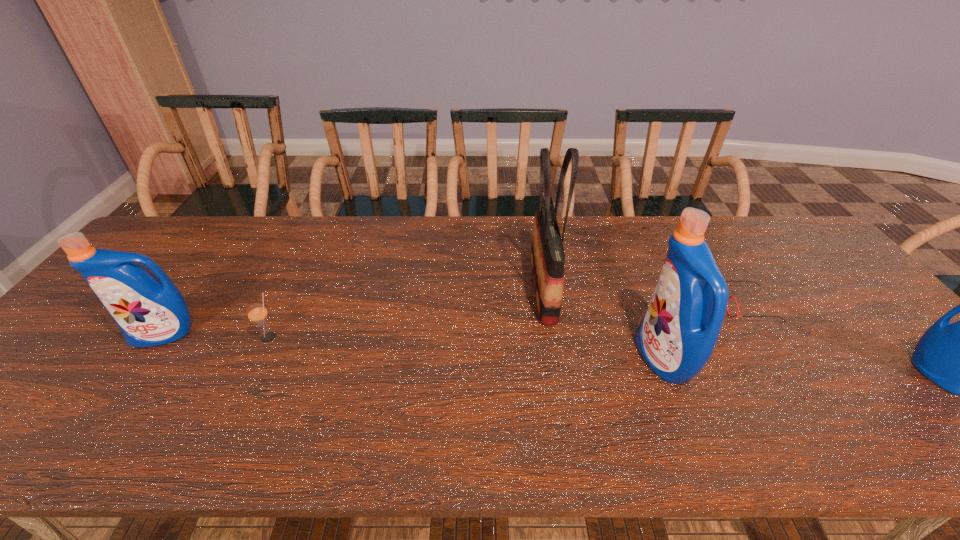
Image resolution: width=960 pixels, height=540 pixels. I want to click on free spot between the third object from right to left and the second shortest object, so click(466, 348).

Where is `free space that is in between the leftmost detergent and the fifth object from left to right`? free space that is in between the leftmost detergent and the fifth object from left to right is located at coordinates (456, 320).

The image size is (960, 540). What are the coordinates of `vacant area between the second shortest object and the fourth object from left to right` in the screenshot? It's located at (466, 348).

Image resolution: width=960 pixels, height=540 pixels. Find the location of `object that stands as the third closest to the rightmost object`. object that stands as the third closest to the rightmost object is located at coordinates (547, 253).

Select which object is the second closest to the fourth object from right to left. Please provide its 2D coordinates. Your answer should be formatted as a tuple, i.e. [(x, y)], where the tuple contains the x and y coordinates of a point satisfying the conditions above.

[(726, 281)]

Locate which detergent ranks second in proximity to the fourth object from right to left. Please provide its 2D coordinates. Your answer should be formatted as a tuple, i.e. [(x, y)], where the tuple contains the x and y coordinates of a point satisfying the conditions above.

[(959, 357)]

The image size is (960, 540). I want to click on detergent that is the closest to the rightmost object, so 678,333.

Locate an element on the screen. vacant space that satisfies the following two spatial constraints: 1. on the front-facing side of the second object from right to left; 2. on the front side of the fifth object from right to left is located at coordinates (768, 338).

Find the location of `vacant space that satisfies the following two spatial constraints: 1. on the label of the fifth object from right to left; 2. on the right side of the third tallest object`. vacant space that satisfies the following two spatial constraints: 1. on the label of the fifth object from right to left; 2. on the right side of the third tallest object is located at coordinates (x=162, y=338).

The height and width of the screenshot is (540, 960). What are the coordinates of `free region that satisfies the following two spatial constraints: 1. on the front-facing side of the fifth object from left to right; 2. on the label of the second tallest detergent` in the screenshot? It's located at (766, 334).